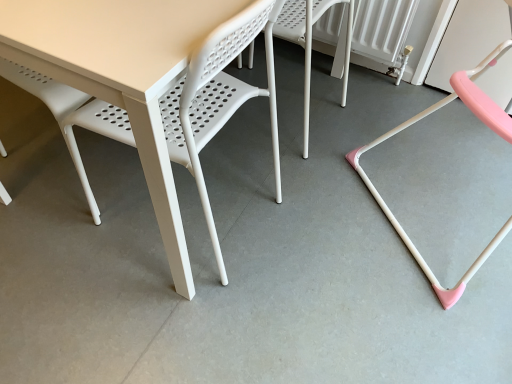
This screenshot has height=384, width=512. Identify the location of vacant area in front of white plastic table at center. (167, 321).